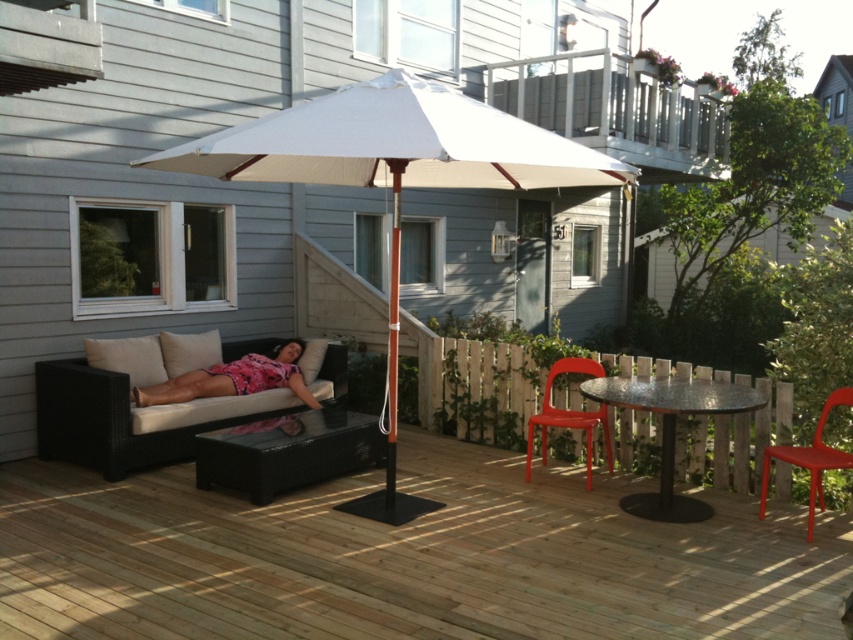
Image resolution: width=853 pixels, height=640 pixels. What do you see at coordinates (393, 179) in the screenshot?
I see `white fabric umbrella at center` at bounding box center [393, 179].

From the picture: Is white fabric umbrella at center shorter than black glass table at center?

Indeed, white fabric umbrella at center has a lesser height compared to black glass table at center.

Who is more distant from viewer, (195, 161) or (664, 502)?

Positioned behind is point (664, 502).

Find the location of a particular element. The width and height of the screenshot is (853, 640). white fabric umbrella at center is located at coordinates (393, 179).

Is black wicker couch at lower left closer to camera compared to pink fabric couch at lower left?

Yes.

Is black wicker couch at lower left bigger than pink fabric couch at lower left?

Yes.

Find the location of a particular element. Image resolution: width=853 pixels, height=640 pixels. black wicker couch at lower left is located at coordinates (123, 419).

I want to click on black wicker couch at lower left, so click(123, 419).

Which of these two, wooden deck at center or black wicker couch at lower left, stands taller?

Standing taller between the two is black wicker couch at lower left.

Between point (10, 465) and point (154, 438), which one is positioned in front?

Positioned in front is point (154, 438).

Is point (531, 593) farther from viewer compared to point (82, 458)?

No.

I want to click on wooden deck at center, so click(x=405, y=557).